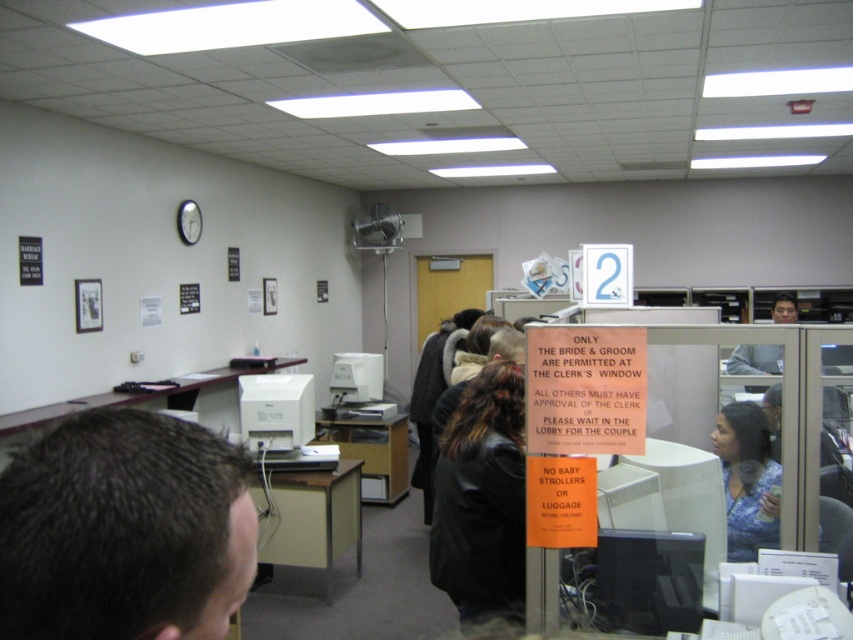
Between point (474, 529) and point (773, 300), which one is positioned in front?

Point (474, 529) is in front.

Can you confirm if black leather jacket at center is thinner than smooth gray shirt at center right?

Incorrect, black leather jacket at center's width is not less than smooth gray shirt at center right's.

Which is in front, point (482, 371) or point (775, 298)?

Point (482, 371) is in front.

You are a GUI agent. You are given a task and a screenshot of the screen. Output one action in this format:
    pyautogui.click(x=<x>, y=<y>)
    Task: Click on the black leather jacket at center
    
    Given the screenshot: What is the action you would take?
    pyautogui.click(x=482, y=499)

Is dark brown hair at upper left below black leather jacket at center?

Actually, dark brown hair at upper left is above black leather jacket at center.

Which is in front, point (180, 429) or point (469, 461)?

Point (180, 429) is more forward.

Locate an element on the screen. dark brown hair at upper left is located at coordinates (125, 529).

Which of these two, dark brown hair at upper left or blue printed blouse at right, stands shorter?

dark brown hair at upper left

Can you confirm if dark brown hair at upper left is shorter than blue printed blouse at right?

Yes, dark brown hair at upper left is shorter than blue printed blouse at right.

Where is `dark brown hair at upper left`? Image resolution: width=853 pixels, height=640 pixels. dark brown hair at upper left is located at coordinates (125, 529).

Where is `dark brown hair at upper left`? This screenshot has height=640, width=853. dark brown hair at upper left is located at coordinates (125, 529).